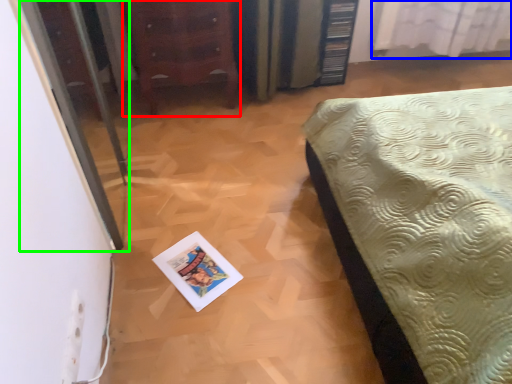
Question: Which object is the farthest from furniture (highlighted by a red box)? Choose among these: curtain (highlighted by a blue box) or screen door (highlighted by a green box).

Choices:
 (A) curtain
 (B) screen door

Answer: (A)